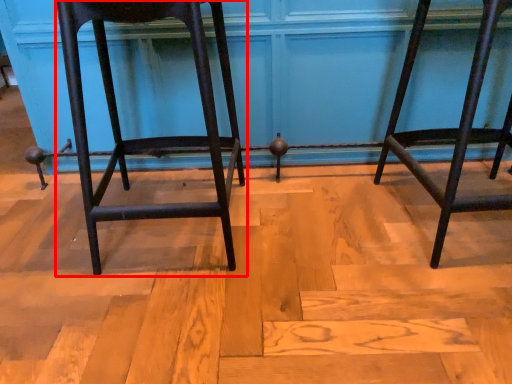
Question: From the image's perspective, what is the correct spatial relationship of furniture (annotated by the red box) in relation to furniture?

Choices:
 (A) below
 (B) above

Answer: (A)